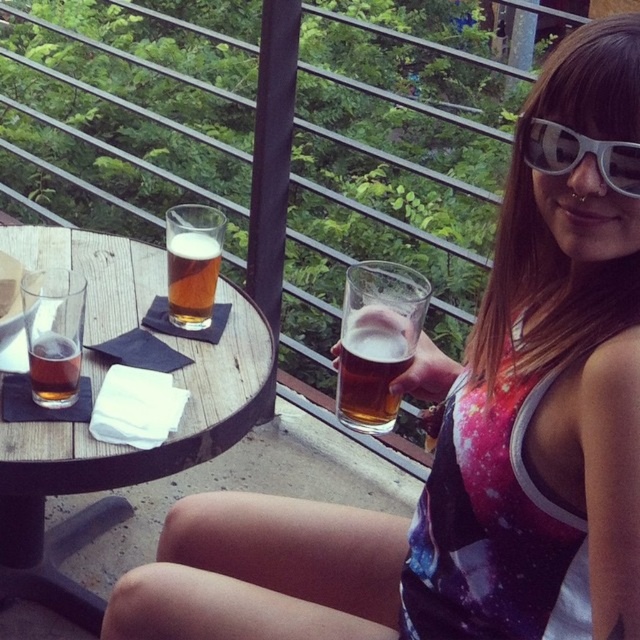
The width and height of the screenshot is (640, 640). I want to click on woodenobject at left, so pyautogui.click(x=122, y=461).

What are the coordinates of `woodenobject at left` in the screenshot? It's located at (122, 461).

Where is `woodenobject at left`? The width and height of the screenshot is (640, 640). woodenobject at left is located at coordinates (122, 461).

Does point (388, 372) lie in front of point (177, 316)?

Yes.

Describe the element at coordinates (369, 378) in the screenshot. This screenshot has height=640, width=640. I see `translucent glass beer at center` at that location.

Looking at this image, who is more forward, (349, 330) or (200, 256)?

Point (349, 330) is in front.

What are the coordinates of `translucent glass beer at center` in the screenshot? It's located at (369, 378).

Can you confirm if translucent glass mug at upper center is shorter than white plastic sunglasses at upper right?

In fact, translucent glass mug at upper center may be taller than white plastic sunglasses at upper right.

Who is positioned more to the left, translucent glass mug at upper center or white plastic sunglasses at upper right?

Positioned to the left is translucent glass mug at upper center.

Is point (339, 406) more distant than point (627, 164)?

Yes, it is.

I want to click on translucent glass mug at upper center, so click(x=376, y=340).